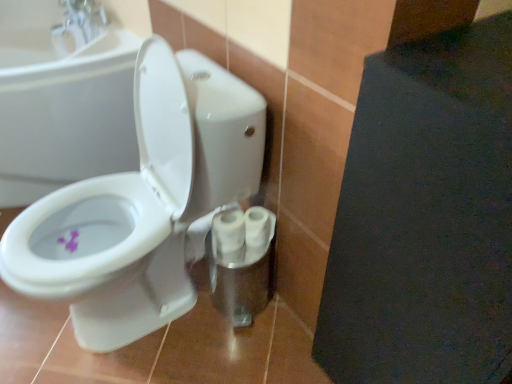
Question: Can you confirm if white glossy toilet paper at center, which is the 1th toilet paper in left-to-right order, is shorter than white glossy toilet at center left?

Choices:
 (A) yes
 (B) no

Answer: (A)

Question: Does white glossy toilet paper at center, acting as the 2th toilet paper starting from the right, have a larger size compared to white glossy toilet at center left?

Choices:
 (A) yes
 (B) no

Answer: (B)

Question: Are white glossy toilet paper at center, acting as the 2th toilet paper starting from the right, and white glossy toilet at center left located far from each other?

Choices:
 (A) no
 (B) yes

Answer: (A)

Question: Does white glossy toilet paper at center, acting as the 2th toilet paper starting from the right, appear on the left side of white glossy toilet at center left?

Choices:
 (A) no
 (B) yes

Answer: (A)

Question: Is white glossy toilet paper at center, acting as the 2th toilet paper starting from the right, beside white glossy toilet at center left?

Choices:
 (A) yes
 (B) no

Answer: (B)

Question: Would you say white glossy toilet at center left is to the left or to the right of purple matte flower at lower left in the picture?

Choices:
 (A) left
 (B) right

Answer: (A)

Question: Considering the positions of white glossy toilet at center left and purple matte flower at lower left in the image, is white glossy toilet at center left wider or thinner than purple matte flower at lower left?

Choices:
 (A) wide
 (B) thin

Answer: (A)

Question: Considering the positions of point pyautogui.click(x=122, y=36) and point pyautogui.click(x=65, y=243), is point pyautogui.click(x=122, y=36) closer or farther from the camera than point pyautogui.click(x=65, y=243)?

Choices:
 (A) closer
 (B) farther

Answer: (B)

Question: From the image's perspective, relative to purple matte flower at lower left, is white glossy toilet at center left above or below?

Choices:
 (A) below
 (B) above

Answer: (B)

Question: From a real-world perspective, relative to white matte toilet paper at lower center, the second toilet paper positioned from the left, is white glossy toilet paper at center, acting as the 2th toilet paper starting from the right, vertically above or below?

Choices:
 (A) below
 (B) above

Answer: (A)

Question: In the image, is white glossy toilet paper at center, which is the 1th toilet paper in left-to-right order, on the left side or the right side of white matte toilet paper at lower center, the second toilet paper positioned from the left?

Choices:
 (A) left
 (B) right

Answer: (A)

Question: Is white glossy toilet paper at center, which is the 1th toilet paper in left-to-right order, in front of or behind white matte toilet paper at lower center, the second toilet paper positioned from the left, in the image?

Choices:
 (A) behind
 (B) front

Answer: (B)

Question: Is white glossy toilet paper at center, which is the 1th toilet paper in left-to-right order, spatially inside white matte toilet paper at lower center, the first toilet paper positioned from the right, or outside of it?

Choices:
 (A) inside
 (B) outside

Answer: (B)

Question: In terms of size, does white glossy toilet at center appear bigger or smaller than white glossy toilet paper at center, which is the 1th toilet paper in left-to-right order?

Choices:
 (A) big
 (B) small

Answer: (A)

Question: In the image, is white glossy toilet at center on the left side or the right side of white glossy toilet paper at center, acting as the 2th toilet paper starting from the right?

Choices:
 (A) right
 (B) left

Answer: (B)